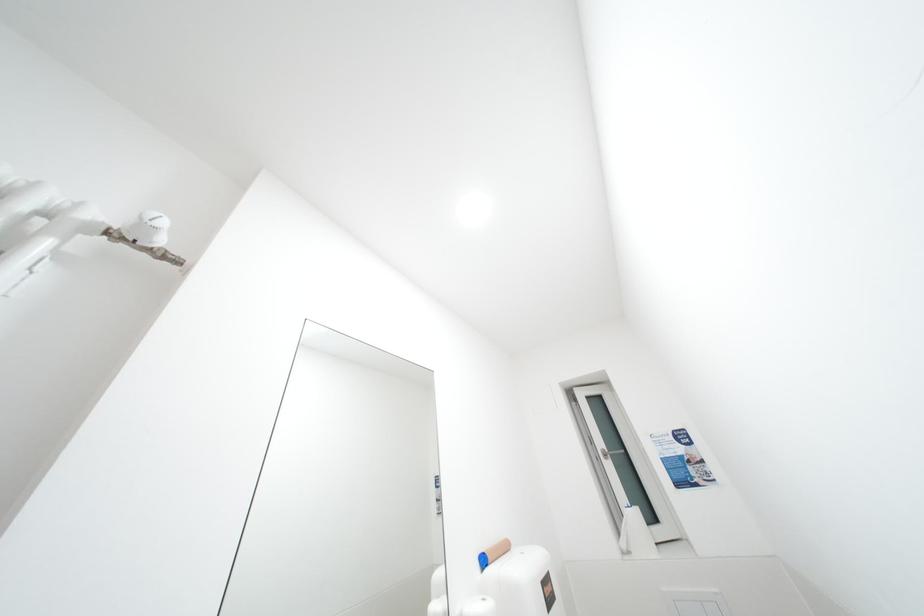
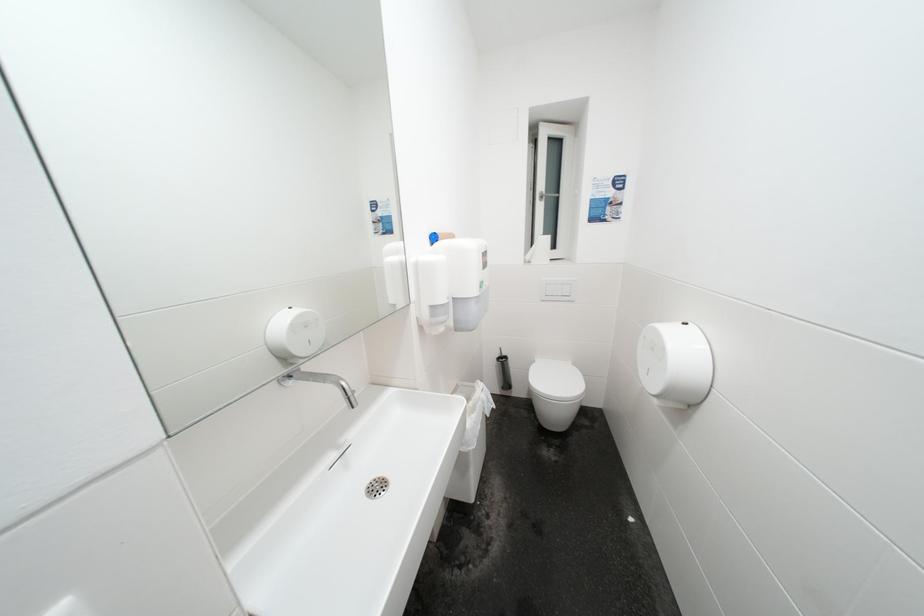
The images are taken continuously from a first-person perspective. In which direction is your viewpoint rotating?

The camera's rotation is toward right-down.